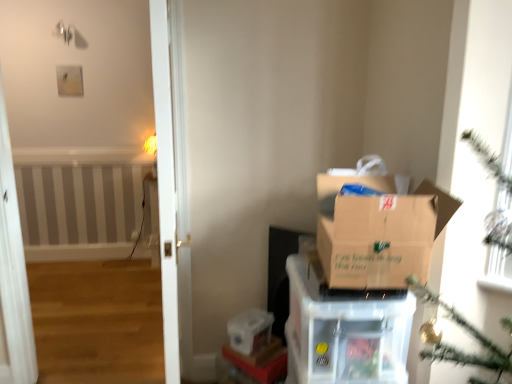
Question: Is brown cardboard box at right not near brown cardboard box at center?

Choices:
 (A) no
 (B) yes

Answer: (A)

Question: Does brown cardboard box at right have a lesser height compared to brown cardboard box at center?

Choices:
 (A) no
 (B) yes

Answer: (A)

Question: Is brown cardboard box at right turned away from brown cardboard box at center?

Choices:
 (A) yes
 (B) no

Answer: (B)

Question: From a real-world perspective, is brown cardboard box at right on brown cardboard box at center?

Choices:
 (A) yes
 (B) no

Answer: (A)

Question: Is the depth of brown cardboard box at right greater than that of brown cardboard box at center?

Choices:
 (A) yes
 (B) no

Answer: (B)

Question: Is the position of brown cardboard box at right less distant than that of brown cardboard box at center?

Choices:
 (A) yes
 (B) no

Answer: (A)

Question: Considering the relative sizes of clear plastic container at lower center and clear plastic storage box at lower center in the image provided, is clear plastic container at lower center smaller than clear plastic storage box at lower center?

Choices:
 (A) no
 (B) yes

Answer: (B)

Question: Considering the relative sizes of clear plastic container at lower center and clear plastic storage box at lower center in the image provided, is clear plastic container at lower center bigger than clear plastic storage box at lower center?

Choices:
 (A) no
 (B) yes

Answer: (A)

Question: Could you tell me if clear plastic container at lower center is turned towards clear plastic storage box at lower center?

Choices:
 (A) no
 (B) yes

Answer: (A)

Question: Would you say clear plastic container at lower center contains clear plastic storage box at lower center?

Choices:
 (A) no
 (B) yes

Answer: (A)

Question: Can you confirm if clear plastic container at lower center is positioned to the left of clear plastic storage box at lower center?

Choices:
 (A) no
 (B) yes

Answer: (A)

Question: From the image's perspective, does clear plastic container at lower center appear higher than clear plastic storage box at lower center?

Choices:
 (A) yes
 (B) no

Answer: (B)

Question: Is clear plastic storage box at lower center looking in the opposite direction of brown cardboard box at right?

Choices:
 (A) no
 (B) yes

Answer: (A)